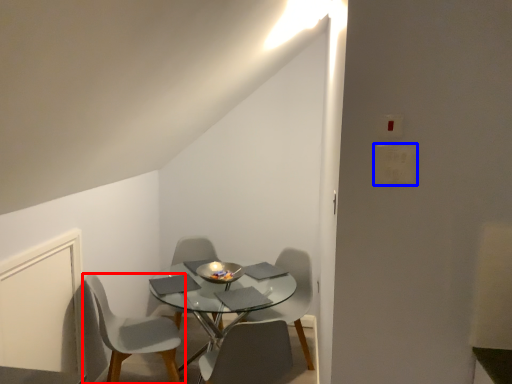
Question: Which object is closer to the camera taking this photo, chair (highlighted by a red box) or light switch (highlighted by a blue box)?

Choices:
 (A) chair
 (B) light switch

Answer: (B)